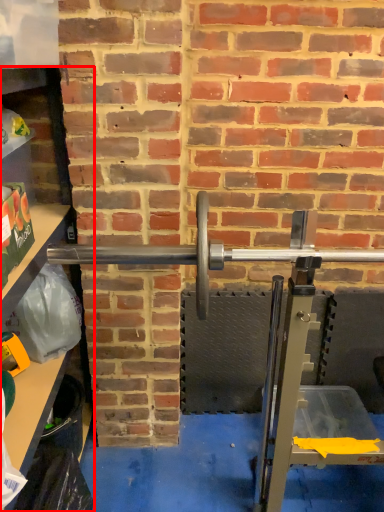
Question: Where is shelf (annotated by the red box) located in relation to barbell in the image?

Choices:
 (A) right
 (B) left

Answer: (B)